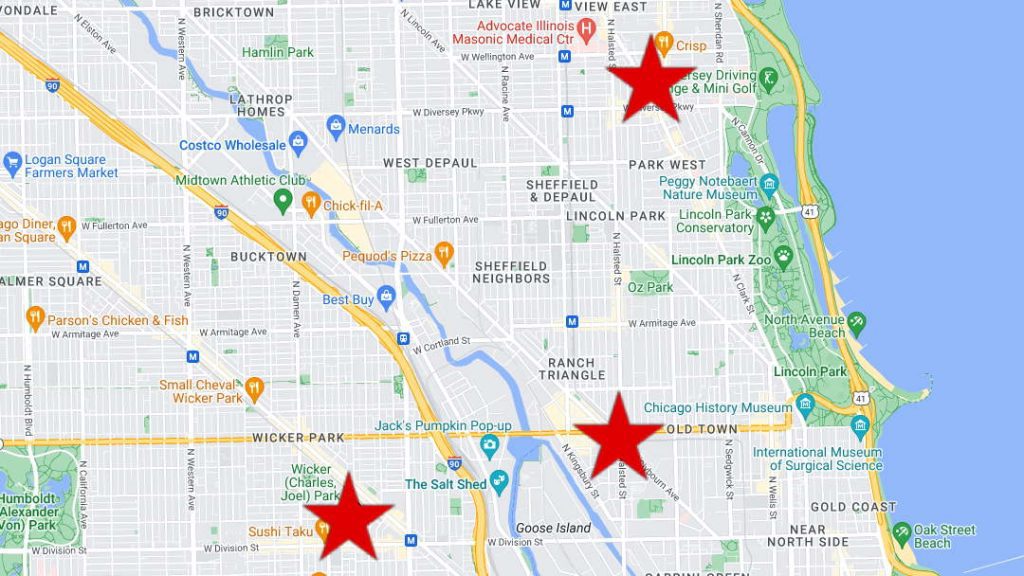
The image size is (1024, 576). Identify the location of restaurants. (325, 530), (317, 575), (256, 386), (36, 316), (72, 225), (308, 207), (439, 255), (664, 36).